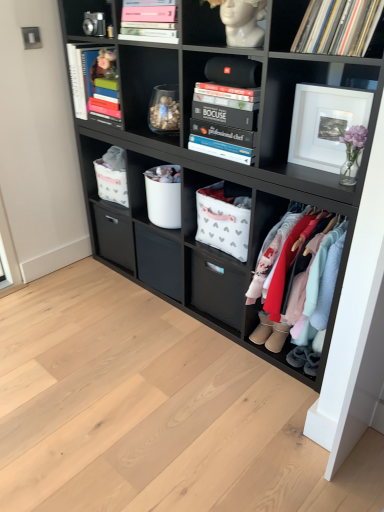
Where is `velvet-like fabric clothes at right, which is the 6th shelf in top-to-bottom order`? velvet-like fabric clothes at right, which is the 6th shelf in top-to-bottom order is located at coordinates (298, 280).

Locate an element on the screen. The image size is (384, 512). white matte picture frame at upper right is located at coordinates (325, 124).

At what (x,y) coordinates should I click in order to perform the action: click on hardcover book at upper left, the 1th magazine positioned from the left. Please return your answer as a coordinate pair (x, y). The width and height of the screenshot is (384, 512). Looking at the image, I should click on (94, 82).

What do you see at coordinates (217, 214) in the screenshot?
I see `white fabric basket at center, the 5th shelf viewed from the top` at bounding box center [217, 214].

Measure the distance between point (262,339) and camera.

The depth of point (262,339) is 5.87 feet.

The image size is (384, 512). What do you see at coordinates (83, 13) in the screenshot?
I see `metallic silver camera at upper left` at bounding box center [83, 13].

You are a GUI agent. You are given a task and a screenshot of the screen. Output one action in this format:
    pyautogui.click(x=<x>, y=<y>)
    Task: Click on the velvet-like fabric clothes at right, the first shelf from the bottom
    
    Given the screenshot: What is the action you would take?
    pyautogui.click(x=298, y=280)

This screenshot has height=512, width=384. I want to click on the 3rd shelf to the left of the black vinyl records at upper right, the first shelf in the top-to-bottom sequence, starting your count from the anchor, so click(228, 106).

Is black hardcover books at center, which is the 5th shelf from bottom to top, taller than black vinyl records at upper right, which is the 6th shelf from bottom to top?

Indeed, black hardcover books at center, which is the 5th shelf from bottom to top, has a greater height compared to black vinyl records at upper right, which is the 6th shelf from bottom to top.

Looking at this image, which of these two, black hardcover books at center, which is the 5th shelf from bottom to top, or black vinyl records at upper right, the first shelf in the top-to-bottom sequence, is bigger?

Bigger between the two is black hardcover books at center, which is the 5th shelf from bottom to top.

Can you confirm if black hardcover books at center, which is the 5th shelf from bottom to top, is thinner than black vinyl records at upper right, which is the 6th shelf from bottom to top?

Yes, black hardcover books at center, which is the 5th shelf from bottom to top, is thinner than black vinyl records at upper right, which is the 6th shelf from bottom to top.

This screenshot has width=384, height=512. In order to click on the 5th shelf positioned below the metallic silver camera at upper left (from a real-world perspective) in this screenshot , I will do `click(217, 214)`.

Is point (78, 16) closer to camera compared to point (247, 208)?

No, (78, 16) is behind (247, 208).

Is metallic silver camera at upper left completely or partially outside of white fabric basket at center, the 5th shelf viewed from the top?

Yes, metallic silver camera at upper left is located beyond the bounds of white fabric basket at center, the 5th shelf viewed from the top.

Which point is more forward, (155, 205) or (73, 8)?

The point (73, 8) is in front.

From a real-world perspective, is white fabric basket at center, marked as the fourth shelf in a top-to-bottom arrangement, under metallic silver camera at upper left?

Yes.

Does white fabric basket at center, marked as the fourth shelf in a top-to-bottom arrangement, come behind metallic silver camera at upper left?

Yes.

Which object is positioned more to the right, white fabric basket at center, placed as the 3th shelf when sorted from bottom to top, or metallic silver camera at upper left?

From the viewer's perspective, white fabric basket at center, placed as the 3th shelf when sorted from bottom to top, appears more on the right side.

From a real-world perspective, is white fabric basket at center, marked as the fourth shelf in a top-to-bottom arrangement, physically below white fabric basket at center, which ranks as the 2th shelf in bottom-to-top order?

No, from a real-world perspective, white fabric basket at center, marked as the fourth shelf in a top-to-bottom arrangement, is not beneath white fabric basket at center, which ranks as the 2th shelf in bottom-to-top order.

In terms of height, does white fabric basket at center, marked as the fourth shelf in a top-to-bottom arrangement, look taller or shorter compared to white fabric basket at center, the 5th shelf viewed from the top?

In the image, white fabric basket at center, marked as the fourth shelf in a top-to-bottom arrangement, appears to be shorter than white fabric basket at center, the 5th shelf viewed from the top.

Is white fabric basket at center, the 5th shelf viewed from the top, located within white fabric basket at center, placed as the 3th shelf when sorted from bottom to top?

No, white fabric basket at center, the 5th shelf viewed from the top, is not inside white fabric basket at center, placed as the 3th shelf when sorted from bottom to top.

From the picture: Is velvet-like fabric clothes at right, the first shelf from the bottom, placed right next to white fabric basket at center, which ranks as the 2th shelf in bottom-to-top order?

velvet-like fabric clothes at right, the first shelf from the bottom, and white fabric basket at center, which ranks as the 2th shelf in bottom-to-top order, are clearly separated.

From a real-world perspective, relative to white fabric basket at center, which ranks as the 2th shelf in bottom-to-top order, is velvet-like fabric clothes at right, the first shelf from the bottom, vertically above or below?

velvet-like fabric clothes at right, the first shelf from the bottom, is situated lower than white fabric basket at center, which ranks as the 2th shelf in bottom-to-top order, in the real world.

Does velvet-like fabric clothes at right, the first shelf from the bottom, have a larger size compared to white fabric basket at center, the 5th shelf viewed from the top?

Yes, velvet-like fabric clothes at right, the first shelf from the bottom, is bigger than white fabric basket at center, the 5th shelf viewed from the top.

Looking at this image, between white suede boot at lower right, which ranks as the first footwear in back-to-front order, and velvet-like fabric clothes at right, which is the 6th shelf in top-to-bottom order, which one appears on the left side from the viewer's perspective?

Positioned to the left is white suede boot at lower right, which ranks as the first footwear in back-to-front order.

Considering the sizes of objects white suede boot at lower right, the first footwear viewed from the left, and velvet-like fabric clothes at right, which is the 6th shelf in top-to-bottom order, in the image provided, who is smaller, white suede boot at lower right, the first footwear viewed from the left, or velvet-like fabric clothes at right, which is the 6th shelf in top-to-bottom order,?

Smaller between the two is white suede boot at lower right, the first footwear viewed from the left.

From a real-world perspective, is white suede boot at lower right, which ranks as the 1th footwear in top-to-bottom order, positioned above or below velvet-like fabric clothes at right, which is the 6th shelf in top-to-bottom order?

white suede boot at lower right, which ranks as the 1th footwear in top-to-bottom order, is below velvet-like fabric clothes at right, which is the 6th shelf in top-to-bottom order.

Is velvet-like fabric clothes at right, the first shelf from the bottom, bigger than black hardcover books at center, which is the 5th shelf from bottom to top?

Indeed, velvet-like fabric clothes at right, the first shelf from the bottom, has a larger size compared to black hardcover books at center, which is the 5th shelf from bottom to top.

From the image's perspective, which is above, velvet-like fabric clothes at right, which is the 6th shelf in top-to-bottom order, or black hardcover books at center, which is the 5th shelf from bottom to top?

black hardcover books at center, which is the 5th shelf from bottom to top.

Considering the positions of points (285, 259) and (193, 112), is point (285, 259) closer to camera compared to point (193, 112)?

That is True.

From a real-world perspective, who is located higher, velvet-like fabric clothes at right, the first shelf from the bottom, or black hardcover books at center, which is the 5th shelf from bottom to top?

From a 3D spatial view, black hardcover books at center, which is the 5th shelf from bottom to top, is above.

Where is `the 1st shelf directly beneath the black vinyl records at upper right, the first shelf in the top-to-bottom sequence (from a real-world perspective)`? The image size is (384, 512). the 1st shelf directly beneath the black vinyl records at upper right, the first shelf in the top-to-bottom sequence (from a real-world perspective) is located at coordinates (228, 106).

Starting from the metallic silver camera at upper left, which shelf is the 4th one to the right? Please provide its 2D coordinates.

[(217, 214)]

Estimate the real-world distances between objects in this image. Which object is closer to white fabric basket at center, placed as the 3th shelf when sorted from bottom to top, velvet-like fabric clothes at right, which is the 6th shelf in top-to-bottom order, or white suede boot at lower right, which ranks as the 1th footwear in top-to-bottom order?

velvet-like fabric clothes at right, which is the 6th shelf in top-to-bottom order, is closer to white fabric basket at center, placed as the 3th shelf when sorted from bottom to top.

Which object lies further to the anchor point velvet-like fabric clothes at right, which is the 6th shelf in top-to-bottom order, black vinyl records at upper right, which is the 6th shelf from bottom to top, or hardcover book at upper left, the 1th magazine positioned from the left?

hardcover book at upper left, the 1th magazine positioned from the left, is further to velvet-like fabric clothes at right, which is the 6th shelf in top-to-bottom order.

Which object lies further to the anchor point white fabric storage bin at center, which appears as the fourth shelf when ordered from the bottom, white matte picture frame at upper right or pink matte book at upper center, which is the 2th magazine from back to front?

pink matte book at upper center, which is the 2th magazine from back to front, is further to white fabric storage bin at center, which appears as the fourth shelf when ordered from the bottom.

When comparing their distances from white matte picture frame at upper right, does hardcover book at upper left, the 1th magazine positioned from the left, or gray suede booties at lower right, which appears as the second footwear when viewed from the back, seem closer?

Based on the image, gray suede booties at lower right, which appears as the second footwear when viewed from the back, appears to be nearer to white matte picture frame at upper right.

Estimate the real-world distances between objects in this image. Which object is further from white fabric storage bin at center, which appears as the fourth shelf when ordered from the bottom, white fabric basket at center, which ranks as the 2th shelf in bottom-to-top order, or white suede boot at lower right, which ranks as the 1th footwear in top-to-bottom order?

Among the two, white suede boot at lower right, which ranks as the 1th footwear in top-to-bottom order, is located further to white fabric storage bin at center, which appears as the fourth shelf when ordered from the bottom.

From the image, which object appears to be farther from hardcover book at upper left, the second magazine positioned from the right, white suede boot at lower right, which ranks as the first footwear in back-to-front order, or white fabric basket at center, which ranks as the 2th shelf in bottom-to-top order?

The object further to hardcover book at upper left, the second magazine positioned from the right, is white suede boot at lower right, which ranks as the first footwear in back-to-front order.

Looking at the image, which one is located closer to white fabric basket at center, placed as the 3th shelf when sorted from bottom to top, white suede boot at lower right, which ranks as the 1th footwear in top-to-bottom order, or black vinyl records at upper right, the first shelf in the top-to-bottom sequence?

white suede boot at lower right, which ranks as the 1th footwear in top-to-bottom order, is positioned closer to the anchor white fabric basket at center, placed as the 3th shelf when sorted from bottom to top.

From the picture: Which object lies nearer to the anchor point velvet-like fabric clothes at right, the first shelf from the bottom, white fabric basket at center, placed as the 3th shelf when sorted from bottom to top, or gray suede booties at lower right, which appears as the second footwear when viewed from the back?

gray suede booties at lower right, which appears as the second footwear when viewed from the back, is closer to velvet-like fabric clothes at right, the first shelf from the bottom.

Locate an element on the screen. The width and height of the screenshot is (384, 512). footwear between white fabric basket at center, which ranks as the 2th shelf in bottom-to-top order, and gray suede booties at lower right, placed as the 1th footwear when sorted from bottom to top, vertically is located at coordinates (262, 329).

Where is `footwear that lies between white fabric basket at center, marked as the fourth shelf in a top-to-bottom arrangement, and gray suede booties at lower right, which appears as the second footwear when viewed from the back, from top to bottom`? footwear that lies between white fabric basket at center, marked as the fourth shelf in a top-to-bottom arrangement, and gray suede booties at lower right, which appears as the second footwear when viewed from the back, from top to bottom is located at coordinates (262, 329).

The width and height of the screenshot is (384, 512). Find the location of `magazine between pink matte book at upper center, positioned as the 1th magazine in front-to-back order, and white suede boot at lower right, the first footwear viewed from the left, from top to bottom`. magazine between pink matte book at upper center, positioned as the 1th magazine in front-to-back order, and white suede boot at lower right, the first footwear viewed from the left, from top to bottom is located at coordinates pos(94,82).

The height and width of the screenshot is (512, 384). In order to click on picture frame between black hardcover books at center, the 2th shelf in the top-to-bottom sequence, and velvet-like fabric clothes at right, the first shelf from the bottom, in the vertical direction in this screenshot , I will do `click(325, 124)`.